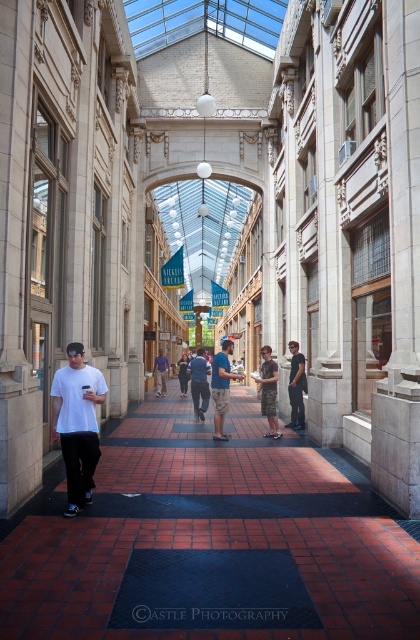
Question: Where is brown tile pavement at center located in relation to dark blue mat at center in the image?

Choices:
 (A) right
 (B) left

Answer: (A)

Question: Is brown tile pavement at center further to the viewer compared to dark blue mat at center?

Choices:
 (A) yes
 (B) no

Answer: (B)

Question: Is white matte t-shirt at center smaller than dark blue jeans at center?

Choices:
 (A) yes
 (B) no

Answer: (B)

Question: Which object is closer to the camera taking this photo?

Choices:
 (A) dark blue jeans at center
 (B) white matte t-shirt at center
 (C) dark gray jeans at center
 (D) dark blue mat at center

Answer: (D)

Question: Which point is closer to the camera taking this photo?

Choices:
 (A) [x=214, y=368]
 (B) [x=288, y=387]
 (C) [x=94, y=440]
 (D) [x=152, y=616]

Answer: (D)

Question: Which of these objects is positioned closest to the white matte t-shirt at center?

Choices:
 (A) dark blue mat at center
 (B) dark gray jeans at center
 (C) dark blue jeans at center

Answer: (A)